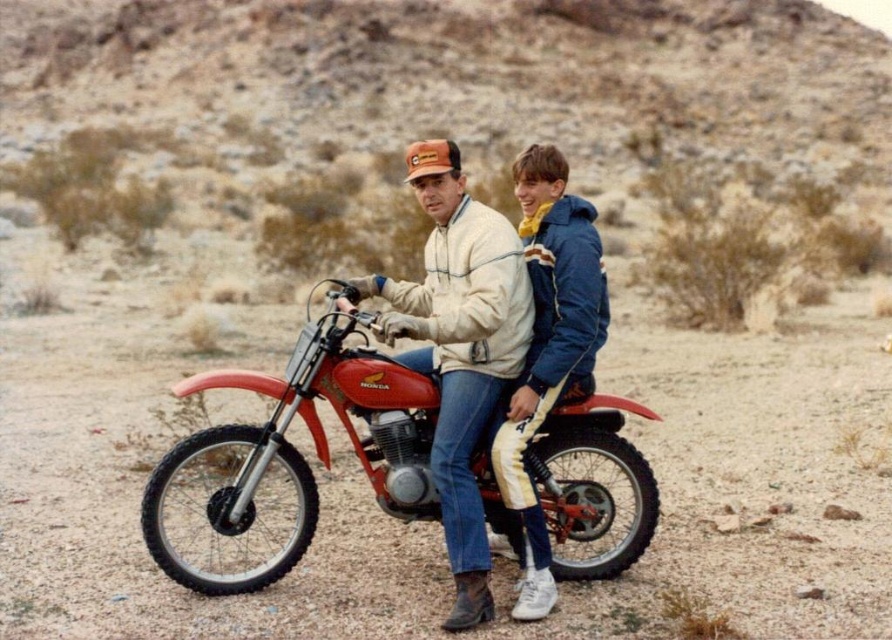
Question: In this image, where is white fleece jacket at center located relative to shiny red dirt bike at center?

Choices:
 (A) right
 (B) left

Answer: (A)

Question: Among these objects, which one is nearest to the camera?

Choices:
 (A) shiny red dirt bike at center
 (B) white fleece jacket at center

Answer: (B)

Question: Which of the following is the farthest from the observer?

Choices:
 (A) (533, 186)
 (B) (216, 460)

Answer: (B)

Question: Is white fleece jacket at center to the left of shiny red dirt bike at center from the viewer's perspective?

Choices:
 (A) yes
 (B) no

Answer: (B)

Question: Is white fleece jacket at center closer to the viewer compared to shiny red dirt bike at center?

Choices:
 (A) no
 (B) yes

Answer: (B)

Question: Among these objects, which one is farthest from the camera?

Choices:
 (A) white fleece jacket at center
 (B) shiny red dirt bike at center

Answer: (B)